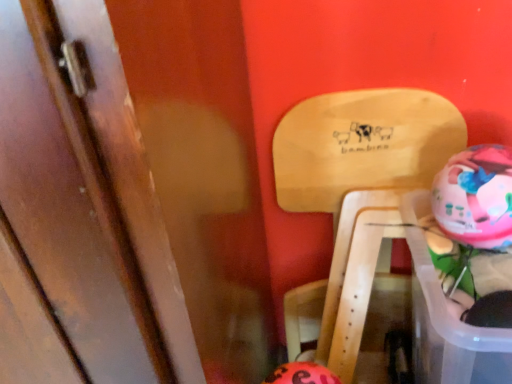
Question: Which direction should I rotate to look at orange matte piggy bank at lower center, the 1th piggy bank when ordered from left to right?

Choices:
 (A) right
 (B) left

Answer: (A)

Question: Is wooden door at left oriented away from natural wood chair at upper right?

Choices:
 (A) no
 (B) yes

Answer: (A)

Question: From the image's perspective, is wooden door at left located beneath natural wood chair at upper right?

Choices:
 (A) no
 (B) yes

Answer: (B)

Question: Is the depth of wooden door at left less than that of natural wood chair at upper right?

Choices:
 (A) yes
 (B) no

Answer: (A)

Question: Considering the relative sizes of wooden door at left and natural wood chair at upper right in the image provided, is wooden door at left smaller than natural wood chair at upper right?

Choices:
 (A) no
 (B) yes

Answer: (A)

Question: Is wooden door at left bigger than natural wood chair at upper right?

Choices:
 (A) no
 (B) yes

Answer: (B)

Question: Considering the relative sizes of wooden door at left and natural wood chair at upper right in the image provided, is wooden door at left thinner than natural wood chair at upper right?

Choices:
 (A) no
 (B) yes

Answer: (A)

Question: Is the position of multicolored plastic piggy bank at right, which is the 2th piggy bank in bottom-to-top order, more distant than that of wooden door at left?

Choices:
 (A) no
 (B) yes

Answer: (B)

Question: Is multicolored plastic piggy bank at right, which is the 2th piggy bank in bottom-to-top order, not close to wooden door at left?

Choices:
 (A) no
 (B) yes

Answer: (A)

Question: Is multicolored plastic piggy bank at right, which is the 2th piggy bank in bottom-to-top order, smaller than wooden door at left?

Choices:
 (A) yes
 (B) no

Answer: (A)

Question: Is multicolored plastic piggy bank at right, arranged as the first piggy bank when viewed from the right, oriented towards wooden door at left?

Choices:
 (A) yes
 (B) no

Answer: (B)

Question: Can you confirm if multicolored plastic piggy bank at right, which is the 2th piggy bank in bottom-to-top order, is taller than wooden door at left?

Choices:
 (A) no
 (B) yes

Answer: (A)

Question: Is multicolored plastic piggy bank at right, which is counted as the 1th piggy bank, starting from the top, in contact with wooden door at left?

Choices:
 (A) yes
 (B) no

Answer: (B)

Question: Is wooden door at left to the right of orange matte piggy bank at lower center, the 1th piggy bank when ordered from left to right, from the viewer's perspective?

Choices:
 (A) yes
 (B) no

Answer: (B)